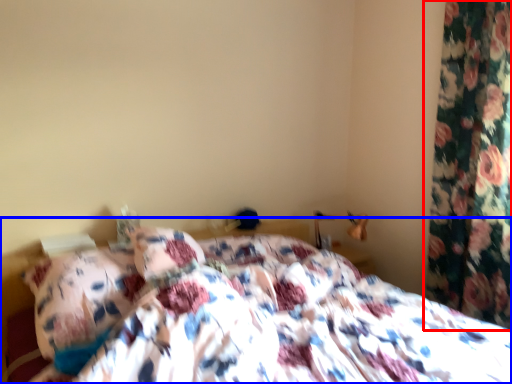
Question: Which of the following is the farthest to the observer, curtain (highlighted by a red box) or bed (highlighted by a blue box)?

Choices:
 (A) curtain
 (B) bed

Answer: (A)